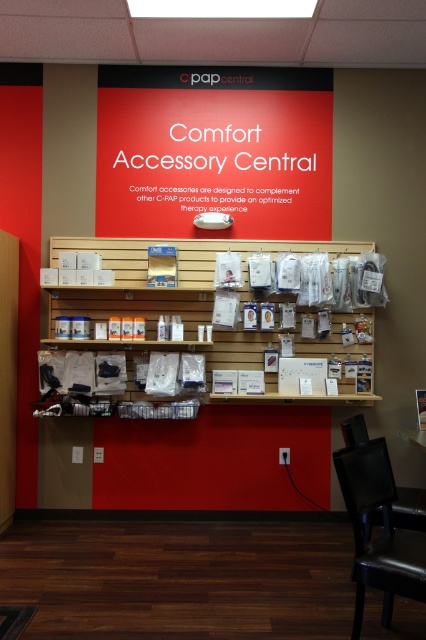
Question: Which point is farther to the camera?

Choices:
 (A) matte plastic bottles at center
 (B) black leather swivel chair at lower right

Answer: (A)

Question: Does red matte signboard at upper center appear over matte plastic bottles at center?

Choices:
 (A) no
 (B) yes

Answer: (B)

Question: Considering the real-world distances, which object is farthest from the red matte signboard at upper center?

Choices:
 (A) wooden shelf at center
 (B) black leather chair at lower right

Answer: (B)

Question: Can you confirm if red matte signboard at upper center is smaller than black leather chair at lower right?

Choices:
 (A) yes
 (B) no

Answer: (A)

Question: Where is black leather swivel chair at lower right located in relation to matte plastic bottles at center in the image?

Choices:
 (A) above
 (B) below

Answer: (B)

Question: Considering the real-world distances, which object is farthest from the black leather swivel chair at lower right?

Choices:
 (A) black leather chair at lower right
 (B) wooden shelf at center
 (C) red matte signboard at upper center

Answer: (C)